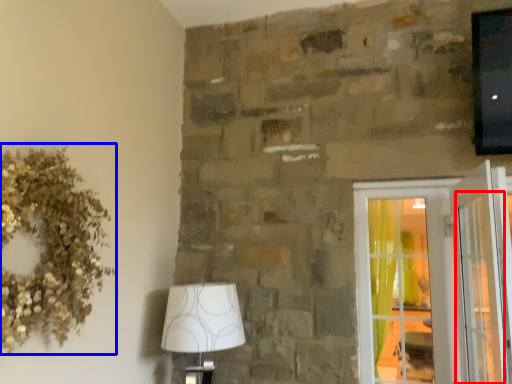
Question: Which of the following is the closest to the observer, screen door (highlighted by a red box) or floral arrangement (highlighted by a blue box)?

Choices:
 (A) screen door
 (B) floral arrangement

Answer: (B)